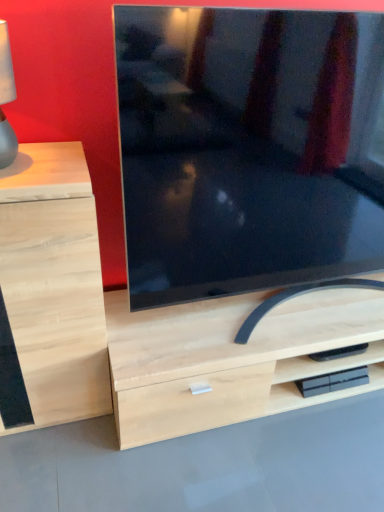
This screenshot has height=512, width=384. What do you see at coordinates (6, 67) in the screenshot?
I see `matte gray lampshade at left` at bounding box center [6, 67].

Where is `matte black tv at center`? The width and height of the screenshot is (384, 512). matte black tv at center is located at coordinates (248, 148).

Is matte gray lampshade at left oriented towards light wood drawer at left?

No, matte gray lampshade at left does not turn towards light wood drawer at left.

From the image's perspective, relative to light wood drawer at left, is matte gray lampshade at left above or below?

Based on their image positions, matte gray lampshade at left is located above light wood drawer at left.

Is matte gray lampshade at left to the left or to the right of light wood drawer at left in the image?

matte gray lampshade at left is positioned on light wood drawer at left's right side.

Can you see matte black tv at center touching light wood drawer at left?

No, matte black tv at center is not making contact with light wood drawer at left.

Considering the relative sizes of matte black tv at center and light wood drawer at left in the image provided, is matte black tv at center shorter than light wood drawer at left?

Incorrect, the height of matte black tv at center does not fall short of that of light wood drawer at left.

Between point (222, 132) and point (56, 176), which one is positioned behind?

Point (222, 132)

Who is more distant, matte black tv at center or light wood drawer at left?

Positioned behind is light wood drawer at left.

From a real-world perspective, is light wood drawer at left beneath matte gray lampshade at left?

Yes, from a real-world perspective, light wood drawer at left is beneath matte gray lampshade at left.

Considering the sizes of objects light wood drawer at left and matte gray lampshade at left in the image provided, who is smaller, light wood drawer at left or matte gray lampshade at left?

With smaller size is matte gray lampshade at left.

The width and height of the screenshot is (384, 512). Find the location of `the chest of drawers below the matte black tv at center (from the image's perspective)`. the chest of drawers below the matte black tv at center (from the image's perspective) is located at coordinates (54, 284).

From the image's perspective, is light wood drawer at left below matte black tv at center?

Yes.

Is light wood drawer at left far away from matte black tv at center?

No, light wood drawer at left is not far away from matte black tv at center.

Which is more distant, (40, 322) or (152, 195)?

Positioned behind is point (40, 322).

From the image's perspective, is matte gray lampshade at left positioned above or below matte black tv at center?

Clearly, from the image's perspective, matte gray lampshade at left is above matte black tv at center.

Based on the photo, how many degrees apart are the facing directions of matte gray lampshade at left and matte black tv at center?

The angular difference between matte gray lampshade at left and matte black tv at center is 3.35 degrees.

Between matte gray lampshade at left and matte black tv at center, which one is positioned behind?

matte gray lampshade at left is further away from the camera.

Would you say matte gray lampshade at left is outside matte black tv at center?

matte gray lampshade at left is positioned outside matte black tv at center.

Is matte black tv at center closer to the viewer compared to matte gray lampshade at left?

Yes, the depth of matte black tv at center is less than that of matte gray lampshade at left.

Is matte black tv at center positioned far away from matte gray lampshade at left?

matte black tv at center is near matte gray lampshade at left, not far away.

Is matte black tv at center oriented away from matte gray lampshade at left?

No, matte black tv at center's orientation is not away from matte gray lampshade at left.

From a real-world perspective, is matte black tv at center physically above matte gray lampshade at left?

No, from a real-world perspective, matte black tv at center is not on top of matte gray lampshade at left.

The image size is (384, 512). Find the location of `the chest of drawers behind the matte gray lampshade at left`. the chest of drawers behind the matte gray lampshade at left is located at coordinates (54, 284).

The width and height of the screenshot is (384, 512). Identify the location of chest of drawers on the left of matte black tv at center. (54, 284).

Based on their spatial positions, is matte black tv at center or matte gray lampshade at left further from light wood drawer at left?

matte black tv at center lies further to light wood drawer at left than the other object.

When comparing their distances from matte gray lampshade at left, does matte black tv at center or light wood drawer at left seem further?

matte black tv at center is positioned further to the anchor matte gray lampshade at left.

Looking at the image, which one is located further to light wood drawer at left, matte gray lampshade at left or matte black tv at center?

Based on the image, matte black tv at center appears to be further to light wood drawer at left.

In the scene shown: Estimate the real-world distances between objects in this image. Which object is closer to matte black tv at center, matte gray lampshade at left or light wood drawer at left?

light wood drawer at left is closer to matte black tv at center.

Looking at the image, which one is located closer to matte black tv at center, light wood drawer at left or matte gray lampshade at left?

light wood drawer at left is positioned closer to the anchor matte black tv at center.

In the scene shown: Which object lies nearer to the anchor point matte gray lampshade at left, light wood drawer at left or matte black tv at center?

light wood drawer at left is closer to matte gray lampshade at left.

Where is `table lamp between light wood drawer at left and matte black tv at center in the horizontal direction`? The width and height of the screenshot is (384, 512). table lamp between light wood drawer at left and matte black tv at center in the horizontal direction is located at coordinates (6, 67).